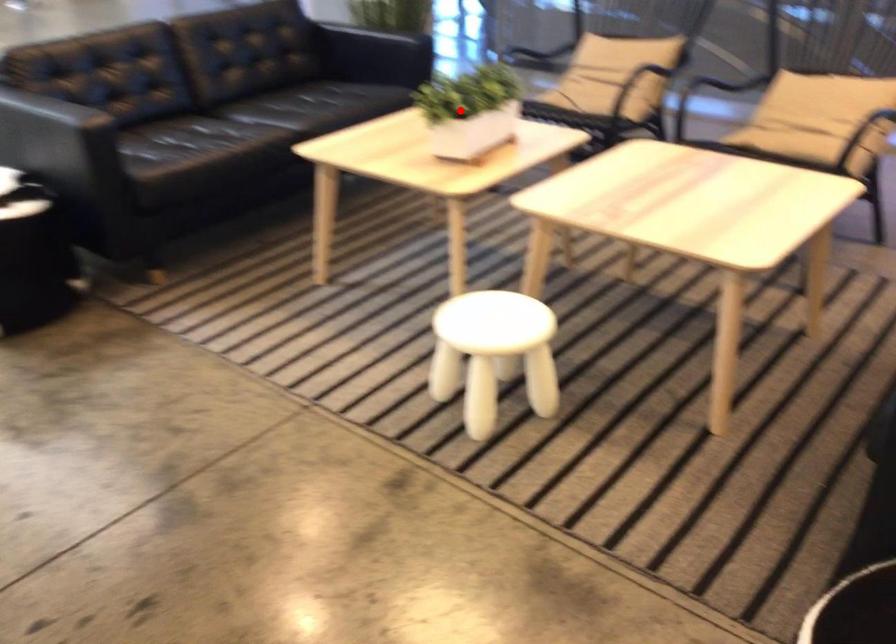
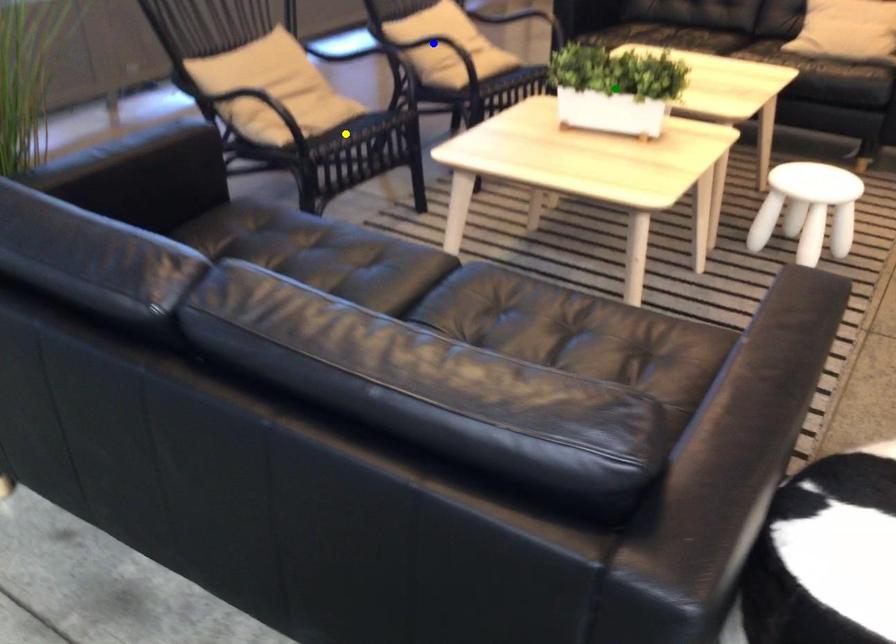
Question: I am providing you with two images of the same scene from different viewpoints. A red point is marked on the first image. You are given multiple points on the second image. Which spot in image 2 lines up with the point in image 1?

Choices:
 (A) green point
 (B) blue point
 (C) yellow point

Answer: (A)